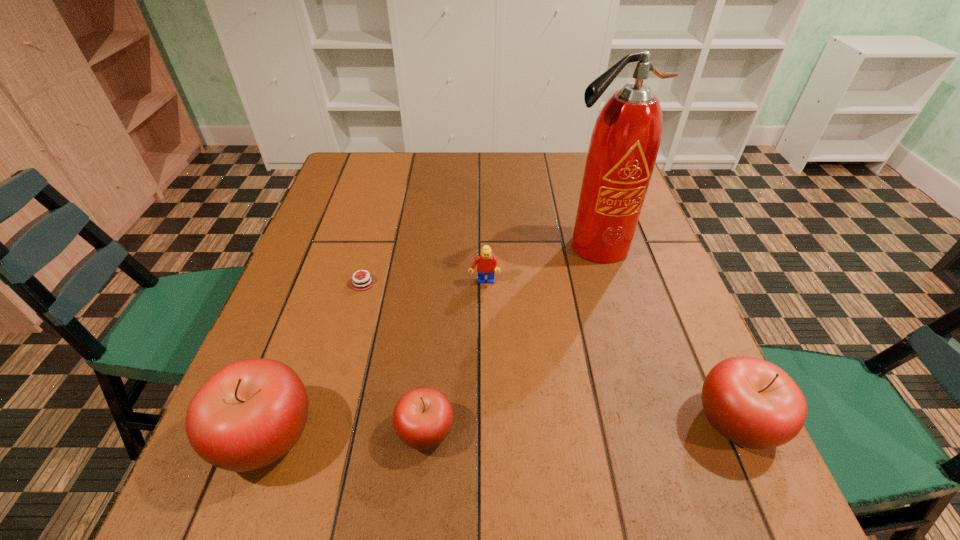
To make them evenly spaced by inserting another apple among them, please locate a free space for this new apple. Please provide its 2D coordinates. Your answer should be formatted as a tuple, i.e. [(x, y)], where the tuple contains the x and y coordinates of a point satisfying the conditions above.

[(582, 426)]